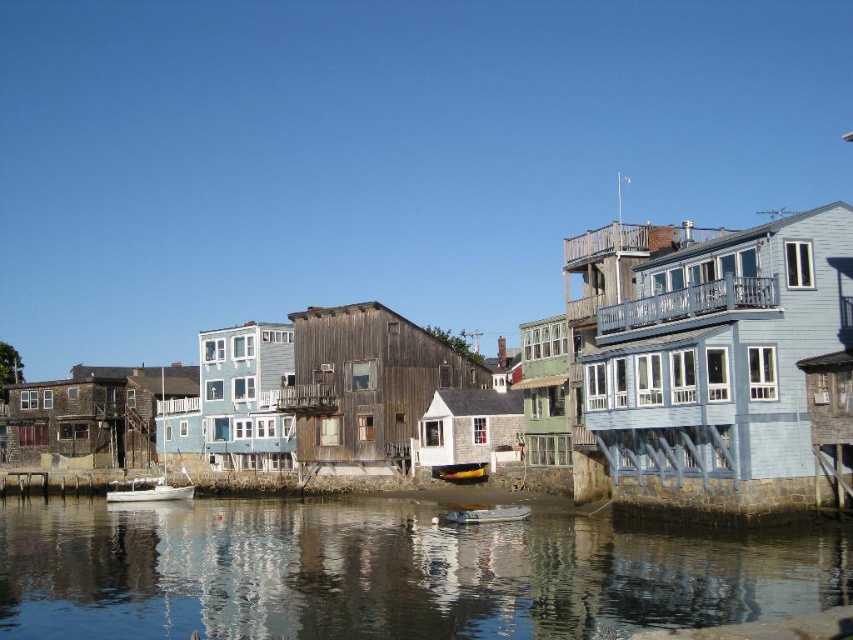
Based on the photo, you are a photographer planning to take a photo of the waterfront scene. You want to ensure both the white glossy boat at center and the yellow plastic boat at center are clearly visible in the frame. Based on their positions, which boat will appear closer to the camera in the photo?

The white glossy boat at center will appear closer to the camera because it is positioned in front of the yellow plastic boat at center.

You are a tour guide leading a group on a boat trip. You need to inform your guests about the distance between the white matte boat at lower left and the yellow plastic boat at center. What do you tell them?

The white matte boat at lower left is 35.90 meters away from the yellow plastic boat at center.

You are a delivery person needing to transport a package weighing 50 kilograms. You have access to both the white glossy boat at center and the yellow plastic boat at center. Which boat should you choose based on their size?

The white glossy boat at center is bigger than the yellow plastic boat at center, so you should choose the white glossy boat at center for transporting the 50 kg package as it can handle larger loads.